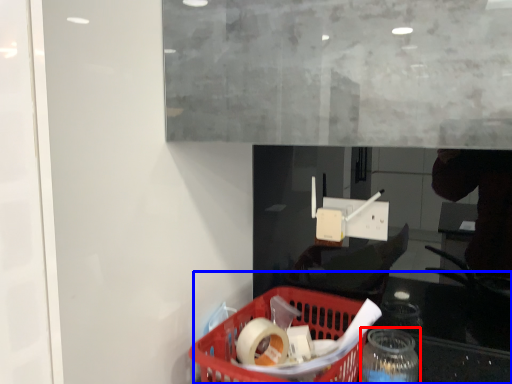
Question: Among these objects, which one is farthest to the camera, bottle (highlighted by a red box) or table (highlighted by a blue box)?

Choices:
 (A) bottle
 (B) table

Answer: (A)